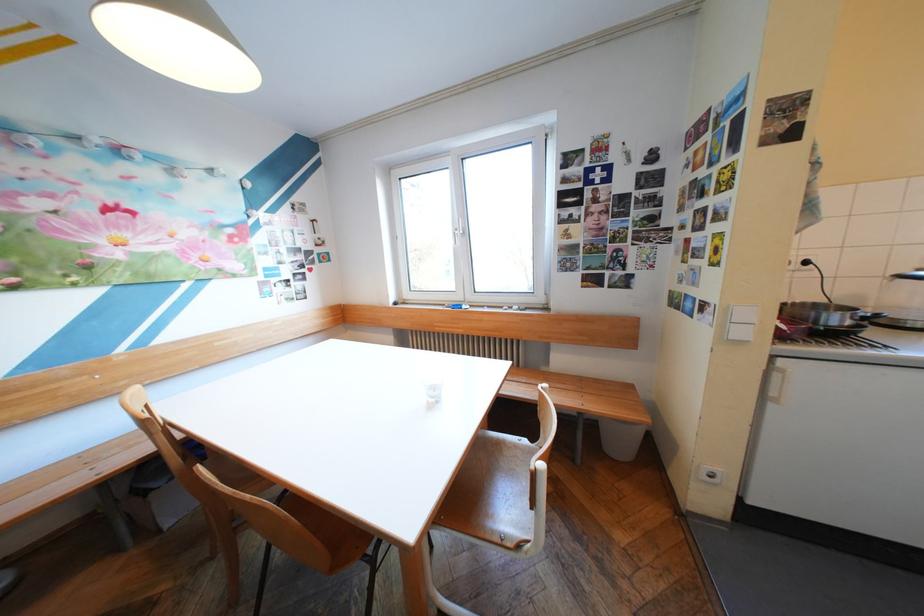
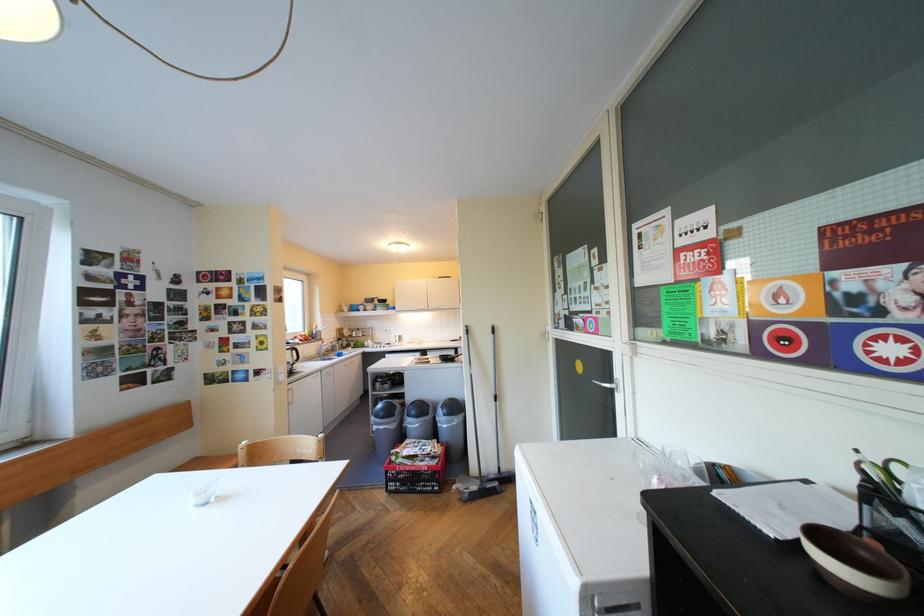
Question: I am providing you with two images of the same scene from different viewpoints. After the viewpoint changes to image2, which objects are now occluded?

Choices:
 (A) faucet handle
 (B) kettle power button
 (C) white trash can
 (D) black broom handle

Answer: (C)